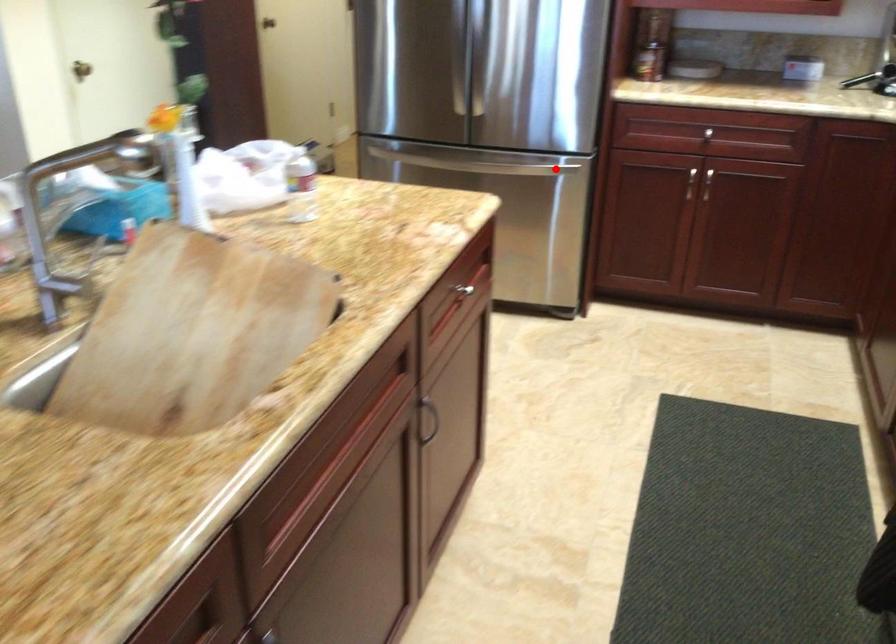
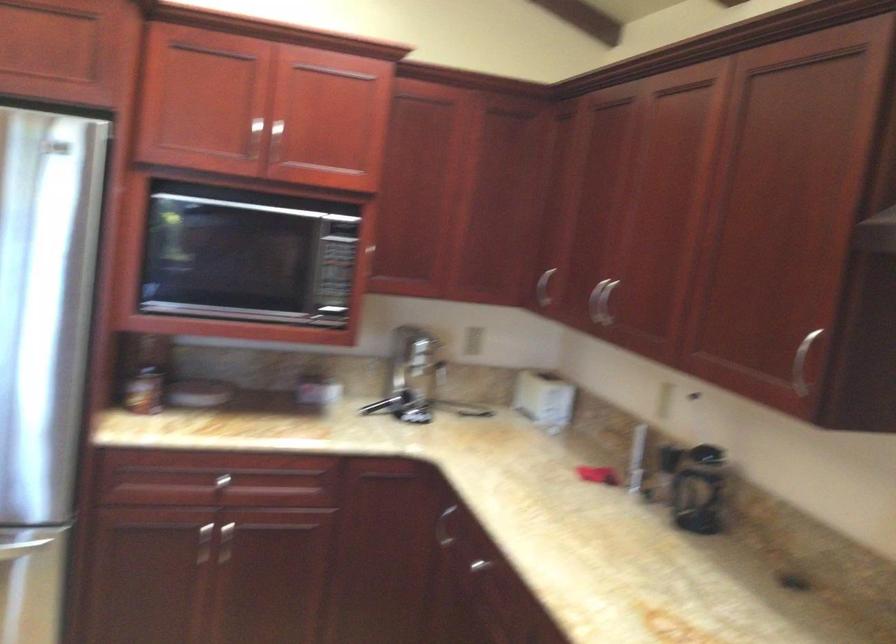
Question: A red point is marked in image1. In image2, is the corresponding 3D point closer to the camera or farther? Reply with the corresponding letter.

Choices:
 (A) The corresponding 3D point is closer.
 (B) The corresponding 3D point is farther.

Answer: (A)